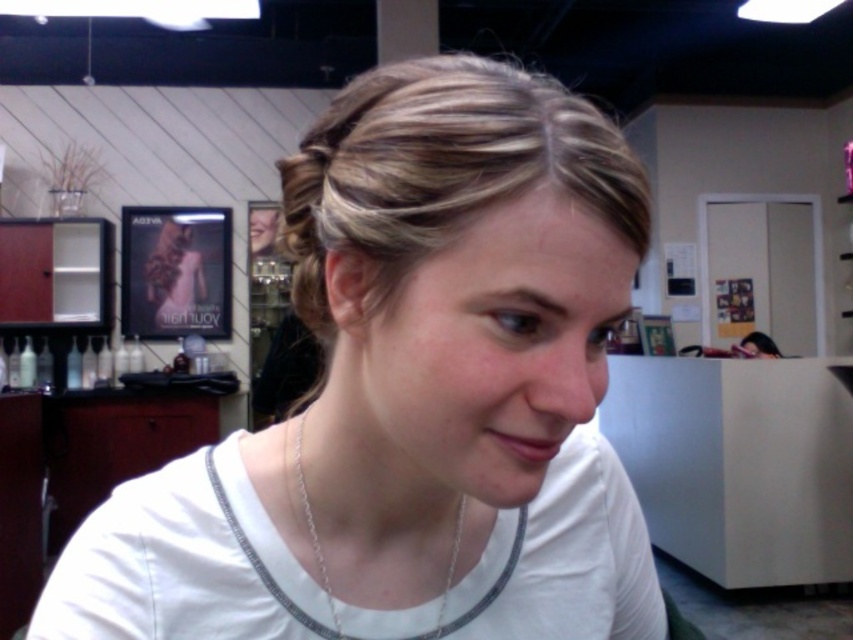
Is white fabric shirt at center above blonde smooth hair at center?

No.

Where is `white fabric shirt at center`? white fabric shirt at center is located at coordinates (412, 394).

Is point (492, 115) closer to camera compared to point (558, 179)?

That is False.

This screenshot has width=853, height=640. I want to click on white fabric shirt at center, so click(x=412, y=394).

Can you confirm if blonde smooth hair at center is taller than silver chain necklace at lower center?

Yes.

In order to click on blonde smooth hair at center in this screenshot , I will do `click(440, 170)`.

Is white fabric shirt at center taller than silver chain necklace at lower center?

Yes, white fabric shirt at center is taller than silver chain necklace at lower center.

Is white fabric shirt at center positioned behind silver chain necklace at lower center?

No, white fabric shirt at center is in front of silver chain necklace at lower center.

Does point (398, 550) come in front of point (444, 589)?

Yes, point (398, 550) is closer to viewer.

Identify the location of white fabric shirt at center. The height and width of the screenshot is (640, 853). (412, 394).